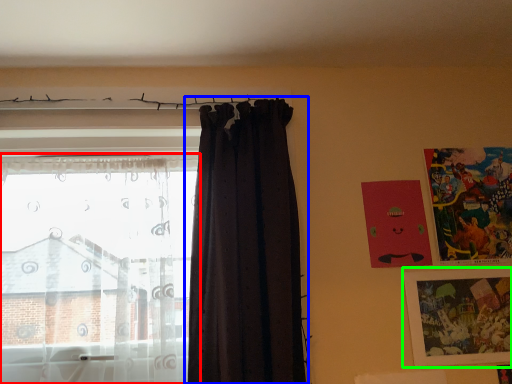
Question: Which is nearer to the curtain (highlighted by a red box)? curtain (highlighted by a blue box) or picture frame (highlighted by a green box).

Choices:
 (A) curtain
 (B) picture frame

Answer: (A)